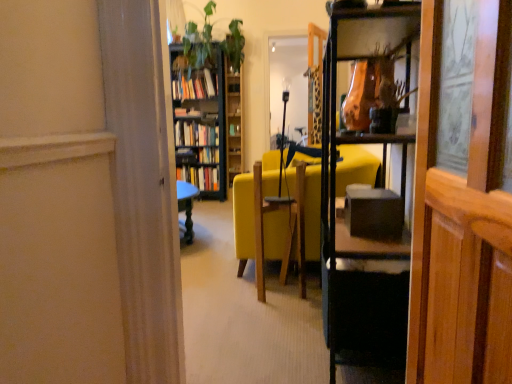
How much space does hardcover book at center, marked as the 1th book in a bottom-to-top arrangement, occupy vertically?

It is 12.34 inches.

Describe the element at coordinates (195, 134) in the screenshot. I see `hardcover books at center, the second book positioned from the top` at that location.

What are the coordinates of `wooden swivel chair at center` in the screenshot? It's located at (x=287, y=231).

Measure the distance between wooden bookcase at center and camera.

The depth of wooden bookcase at center is 15.31 feet.

In order to face black glossy table at center, should I rotate leftwards or rightwards?

Turn right approximately 14.199 degrees to face it.

The image size is (512, 384). What are the coordinates of `hardcover books at center, which ranks as the 3th book in bottom-to-top order` in the screenshot? It's located at 195,86.

Which is in front, point (336, 200) or point (202, 40)?

The point (336, 200) is closer to the camera.

Is black glossy table at center wider than green leafy plant at upper center?

Incorrect, the width of black glossy table at center does not surpass that of green leafy plant at upper center.

Choose the correct answer: Is black glossy table at center inside green leafy plant at upper center or outside it?

black glossy table at center exists outside the volume of green leafy plant at upper center.

Which of these two, black glossy table at center or green leafy plant at upper center, stands shorter?

black glossy table at center.

Is yellow fabric chair at center wider than black glossy table at center?

Indeed, yellow fabric chair at center has a greater width compared to black glossy table at center.

From a real-world perspective, is yellow fabric chair at center located beneath black glossy table at center?

No, from a real-world perspective, yellow fabric chair at center is not below black glossy table at center.

This screenshot has height=384, width=512. In order to click on table to the right of yellow fabric chair at center in this screenshot , I will do `click(362, 294)`.

Is yellow fabric chair at center not within black glossy table at center?

Yes, yellow fabric chair at center is outside of black glossy table at center.

The image size is (512, 384). I want to click on plant above the hardcover books at center, which appears as the second book when ordered from the bottom (from the image's perspective), so click(x=198, y=42).

Could you tell me if hardcover books at center, the second book positioned from the top, is turned towards green leafy plant at upper center?

No, hardcover books at center, the second book positioned from the top, is not facing towards green leafy plant at upper center.

From the picture: How many degrees apart are the facing directions of hardcover books at center, which appears as the second book when ordered from the bottom, and green leafy plant at upper center?

The angular difference between hardcover books at center, which appears as the second book when ordered from the bottom, and green leafy plant at upper center is 0.313 degrees.

Is hardcover books at center, the second book positioned from the top, shorter than green leafy plant at upper center?

Indeed, hardcover books at center, the second book positioned from the top, has a lesser height compared to green leafy plant at upper center.

Is point (372, 250) less distant than point (180, 80)?

Yes, it is.

Considering the positions of objects black glossy table at center and hardcover books at center, which ranks as the first book in top-to-bottom order, in the image provided, who is more to the left, black glossy table at center or hardcover books at center, which ranks as the first book in top-to-bottom order,?

From the viewer's perspective, hardcover books at center, which ranks as the first book in top-to-bottom order, appears more on the left side.

Does black glossy table at center have a lesser height compared to hardcover books at center, which ranks as the first book in top-to-bottom order?

No.

Looking at this image, from a real-world perspective, does yellow fabric chair at center sit lower than wooden swivel chair at center?

Indeed, from a real-world perspective, yellow fabric chair at center is positioned beneath wooden swivel chair at center.

Based on the photo, is yellow fabric chair at center turned away from wooden swivel chair at center?

That's not correct — yellow fabric chair at center is not looking away from wooden swivel chair at center.

Between point (273, 231) and point (262, 253), which one is positioned behind?

Point (273, 231)

Does yellow fabric chair at center have a lesser height compared to wooden swivel chair at center?

No.

Consider the image. Can you tell me how much hardcover books at center, which ranks as the 3th book in bottom-to-top order, and wooden bookshelf at upper center differ in facing direction?

The facing directions of hardcover books at center, which ranks as the 3th book in bottom-to-top order, and wooden bookshelf at upper center are 2.3 degrees apart.

From the image's perspective, is hardcover books at center, which ranks as the first book in top-to-bottom order, above or below wooden bookshelf at upper center?

From the image's perspective, hardcover books at center, which ranks as the first book in top-to-bottom order, appears above wooden bookshelf at upper center.

Is hardcover books at center, which ranks as the 3th book in bottom-to-top order, far away from wooden bookshelf at upper center?

hardcover books at center, which ranks as the 3th book in bottom-to-top order, is near wooden bookshelf at upper center, not far away.

Does hardcover books at center, which ranks as the 3th book in bottom-to-top order, turn towards wooden bookshelf at upper center?

No.

Is the surface of black glossy table at center in direct contact with hardcover book at center, marked as the 1th book in a bottom-to-top arrangement?

No, black glossy table at center is not beside hardcover book at center, marked as the 1th book in a bottom-to-top arrangement.

Does black glossy table at center have a larger size compared to hardcover book at center, the third book positioned from the top?

Yes, black glossy table at center is bigger than hardcover book at center, the third book positioned from the top.

Looking at this image, which object is closer to the camera, black glossy table at center or hardcover book at center, marked as the 1th book in a bottom-to-top arrangement?

Positioned in front is black glossy table at center.

From the image's perspective, is black glossy table at center over hardcover book at center, marked as the 1th book in a bottom-to-top arrangement?

No, from the image's perspective, black glossy table at center is not above hardcover book at center, marked as the 1th book in a bottom-to-top arrangement.

At what (x,y) coordinates should I click in order to perform the action: click on table located in front of the green leafy plant at upper center. Please return your answer as a coordinate pair (x, y). Looking at the image, I should click on (362, 294).

The image size is (512, 384). What are the coordinates of `table below the yellow fabric chair at center (from a real-world perspective)` in the screenshot? It's located at (362, 294).

Looking at the image, which one is located closer to hardcover books at center, which appears as the second book when ordered from the bottom, green leafy plant at upper center or wooden swivel chair at center?

The object closer to hardcover books at center, which appears as the second book when ordered from the bottom, is green leafy plant at upper center.

From the image, which object appears to be nearer to hardcover book at center, the third book positioned from the top, wooden swivel chair at center or hardcover books at center, the second book positioned from the top?

The object closer to hardcover book at center, the third book positioned from the top, is hardcover books at center, the second book positioned from the top.

Considering their positions, is black glossy table at center positioned further to wooden swivel chair at center than wooden bookcase at center?

wooden bookcase at center.

Based on their spatial positions, is hardcover book at center, the third book positioned from the top, or yellow fabric chair at center closer to wooden bookcase at center?

hardcover book at center, the third book positioned from the top, lies closer to wooden bookcase at center than the other object.

Considering their positions, is yellow fabric chair at center positioned further to wooden swivel chair at center than green leafy plant at upper center?

Based on the image, green leafy plant at upper center appears to be further to wooden swivel chair at center.

Consider the image. Based on their spatial positions, is black glossy table at center or wooden bookshelf at upper center closer to yellow fabric chair at center?

Based on the image, black glossy table at center appears to be nearer to yellow fabric chair at center.

Which object lies nearer to the anchor point yellow fabric chair at center, green leafy plant at upper center or hardcover books at center, which ranks as the first book in top-to-bottom order?

green leafy plant at upper center lies closer to yellow fabric chair at center than the other object.

Looking at the image, which one is located closer to yellow fabric chair at center, hardcover book at center, marked as the 1th book in a bottom-to-top arrangement, or hardcover books at center, the second book positioned from the top?

The object closer to yellow fabric chair at center is hardcover book at center, marked as the 1th book in a bottom-to-top arrangement.

Identify the location of swivel chair located between black glossy table at center and hardcover books at center, which appears as the second book when ordered from the bottom, in the depth direction. (287, 231).

Identify the location of swivel chair between black glossy table at center and yellow fabric chair at center in the front-back direction. (287, 231).

At what (x,y) coordinates should I click in order to perform the action: click on bookcase positioned between yellow fabric chair at center and hardcover books at center, the second book positioned from the top, from near to far. Please return your answer as a coordinate pair (x, y). Looking at the image, I should click on (200, 124).

At what (x,y) coordinates should I click in order to perform the action: click on swivel chair between black glossy table at center and hardcover books at center, which ranks as the first book in top-to-bottom order, from front to back. Please return your answer as a coordinate pair (x, y). Looking at the image, I should click on (287, 231).